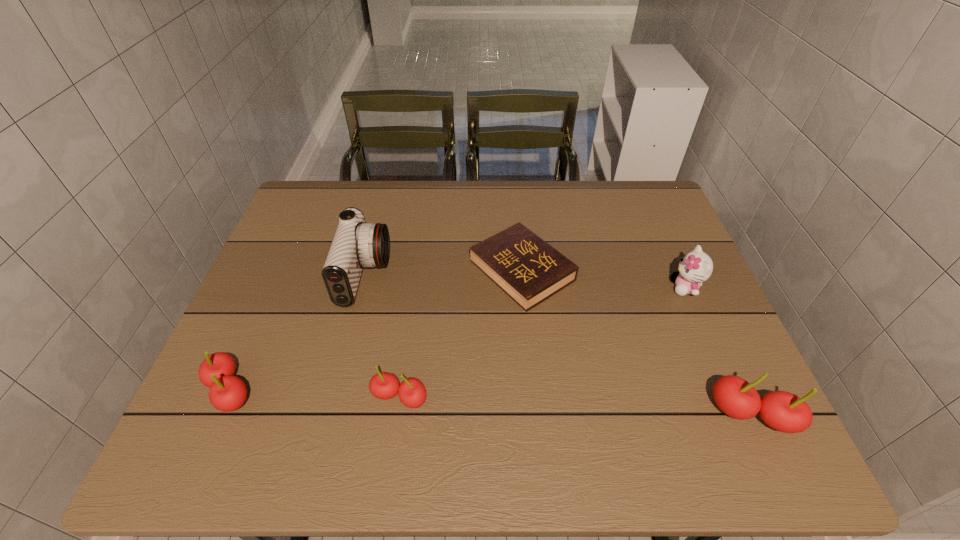
Find the location of `the leftmost object`. the leftmost object is located at coordinates (227, 393).

The height and width of the screenshot is (540, 960). Find the location of `the second shortest cherry`. the second shortest cherry is located at coordinates (x=227, y=393).

Image resolution: width=960 pixels, height=540 pixels. I want to click on the second cherry from left to right, so click(x=412, y=393).

Where is `the shortest cherry`? the shortest cherry is located at coordinates (412, 393).

Locate an element on the screen. The height and width of the screenshot is (540, 960). the rightmost cherry is located at coordinates (783, 411).

At what (x,y) coordinates should I click in order to perform the action: click on camcorder. Please return your answer as a coordinate pair (x, y). Looking at the image, I should click on (356, 244).

At what (x,y) coordinates should I click in order to perform the action: click on kitten. Please return your answer as a coordinate pair (x, y). The width and height of the screenshot is (960, 540). Looking at the image, I should click on (696, 267).

At what (x,y) coordinates should I click in order to perform the action: click on the shortest object. Please return your answer as a coordinate pair (x, y). Looking at the image, I should click on (529, 270).

Find the location of a particular element. This screenshot has width=960, height=540. the third object from right to left is located at coordinates (529, 270).

This screenshot has height=540, width=960. Find the location of `free region located 0.380m on the right of the third object from left to right`. free region located 0.380m on the right of the third object from left to right is located at coordinates (608, 397).